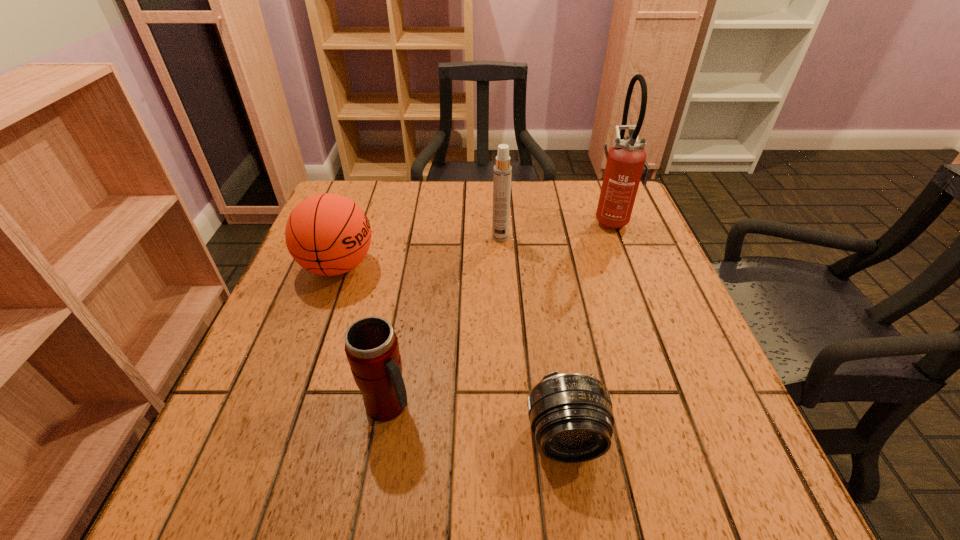
Locate an element on the screen. Image resolution: width=960 pixels, height=540 pixels. vacant area that lies between the third object from right to left and the tallest object is located at coordinates pyautogui.click(x=557, y=228).

At what (x,y) coordinates should I click in order to perform the action: click on empty space that is in between the third object from right to left and the shortest object. Please return your answer as a coordinate pair (x, y). The image size is (960, 540). Looking at the image, I should click on (533, 337).

Identify the location of free space between the thermos bottle and the fire extinguisher. point(500,312).

Identify which object is located as the second nearest to the leftmost object. Please provide its 2D coordinates. Your answer should be formatted as a tuple, i.e. [(x, y)], where the tuple contains the x and y coordinates of a point satisfying the conditions above.

[(502, 172)]

The height and width of the screenshot is (540, 960). Identify the location of the third closest object relative to the aerosol can. (371, 346).

The image size is (960, 540). Find the location of `vacant position in the image that satisfies the following two spatial constraints: 1. at the nozzle of the tallest object; 2. at the front element of the shortest object`. vacant position in the image that satisfies the following two spatial constraints: 1. at the nozzle of the tallest object; 2. at the front element of the shortest object is located at coordinates (697, 437).

What are the coordinates of `free location that satisfies the following two spatial constraints: 1. at the nozzle of the rightmost object; 2. at the front element of the telephoto lens` in the screenshot? It's located at (697, 437).

Identify the location of vacant space that satisfies the following two spatial constraints: 1. at the nozzle of the tallest object; 2. at the front element of the fourth object from left to right. Image resolution: width=960 pixels, height=540 pixels. (697, 437).

This screenshot has width=960, height=540. I want to click on vacant space that satisfies the following two spatial constraints: 1. at the nozzle of the rightmost object; 2. on the front side of the third object from right to left, so click(x=619, y=238).

You are a GUI agent. You are given a task and a screenshot of the screen. Output one action in this format:
    pyautogui.click(x=<x>, y=<y>)
    Task: Click on the vacant region that satisfies the following two spatial constraints: 1. at the nozzle of the tallest object; 2. at the front element of the fourth object from left to right
    The image size is (960, 540).
    Given the screenshot: What is the action you would take?
    click(697, 437)